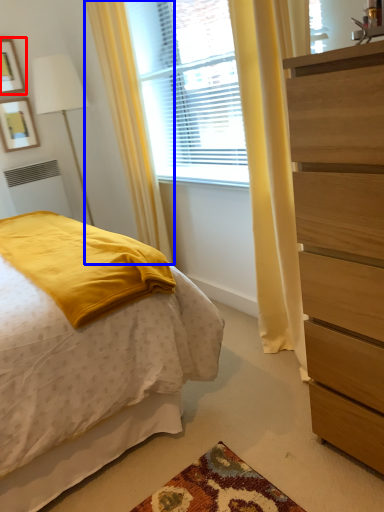
Question: Which object is closer to the camera taking this photo, picture frame (highlighted by a red box) or curtain (highlighted by a blue box)?

Choices:
 (A) picture frame
 (B) curtain

Answer: (B)